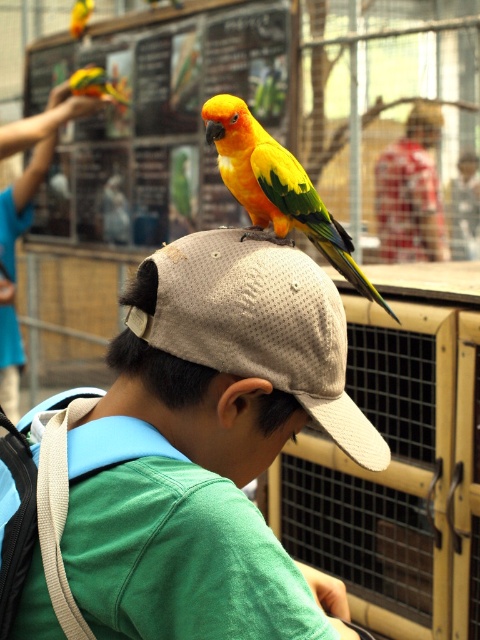
You are a customer at the pet store and want to choose a cap that can comfortably fit a parrot on top. The store has a matte khaki cap at center and a beige mesh baseball cap at center. Based on their sizes, which cap would be more suitable for the parrot to perch on?

The matte khaki cap at center is larger in size than the beige mesh baseball cap at center, so the matte khaki cap at center would be more suitable for the parrot to perch on due to its larger size providing better stability.

You are a photographer standing in front of the beige mesh baseball cap at center. You want to take a clear photo of it using a camera that has a minimum focusing distance of 1 meter. Can you take the photo without moving closer?

The beige mesh baseball cap at center and camera are 1.03 meters apart from each other. Since the minimum focusing distance is 1 meter, the camera can focus on the beige mesh baseball cap at center as the distance is slightly more than required, so yes, you can take the photo without moving closer.